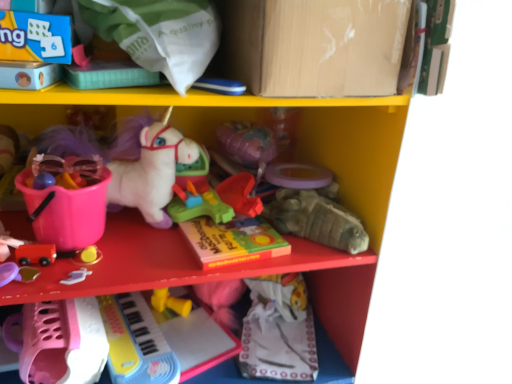
Locate an element on the screen. The width and height of the screenshot is (512, 384). vacant space in front of yellow rubber toy at lower center, the second toy ordered from the bottom is located at coordinates (182, 336).